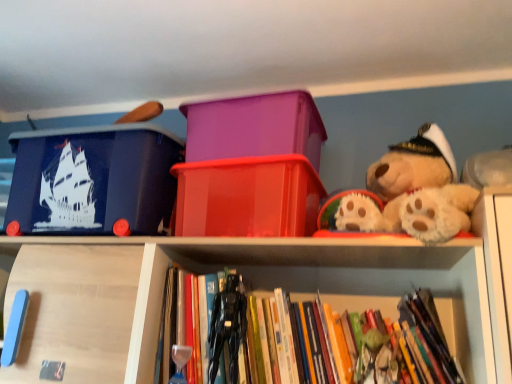
Question: In terms of size, does matte blue plastic storage box at upper left, the 1th storage box from the left, appear bigger or smaller than translucent red plastic container at center, acting as the second storage box starting from the right?

Choices:
 (A) big
 (B) small

Answer: (A)

Question: Considering the relative positions of matte blue plastic storage box at upper left, the third storage box in the right-to-left sequence, and translucent red plastic container at center, acting as the second storage box starting from the right, in the image provided, is matte blue plastic storage box at upper left, the third storage box in the right-to-left sequence, to the left or to the right of translucent red plastic container at center, acting as the second storage box starting from the right,?

Choices:
 (A) left
 (B) right

Answer: (A)

Question: Based on their relative distances, which object is nearer to the black plastic action figure at center?

Choices:
 (A) matte blue plastic storage box at upper left, the third storage box in the right-to-left sequence
 (B) translucent red plastic container at center, acting as the second storage box starting from the right
 (C) purple plastic storage box at center, marked as the first storage box in a right-to-left arrangement
 (D) hardcover books at center

Answer: (D)

Question: Which is nearer to the black plastic action figure at center?

Choices:
 (A) purple plastic storage box at center, marked as the first storage box in a right-to-left arrangement
 (B) matte blue plastic storage box at upper left, the third storage box in the right-to-left sequence
 (C) hardcover books at center
 (D) translucent red plastic container at center, acting as the second storage box starting from the right

Answer: (C)